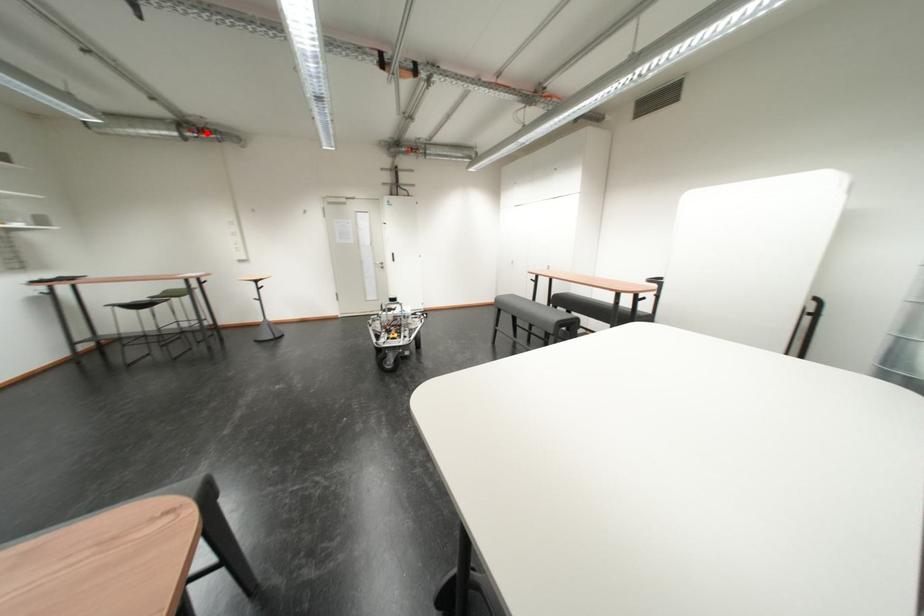
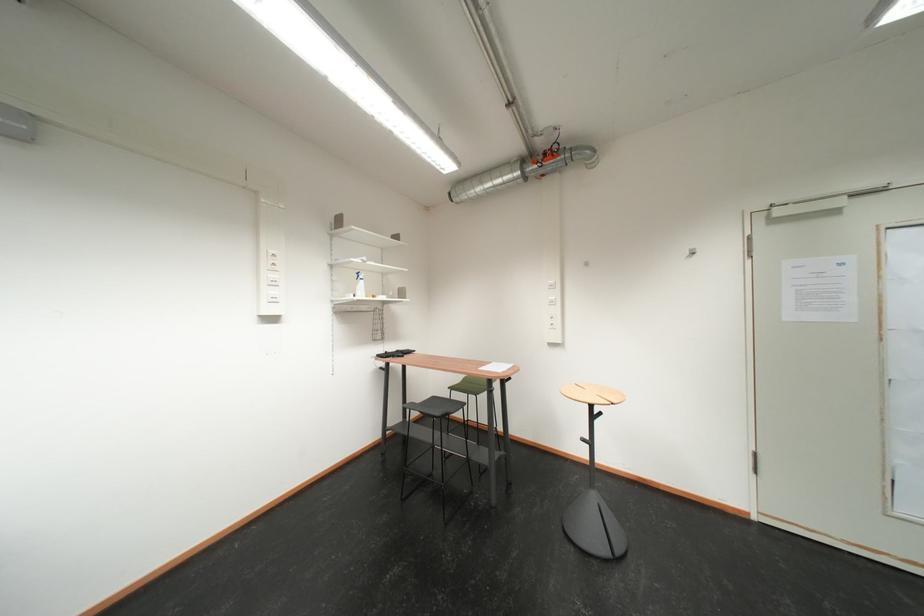
The point at the highlighted location is marked in the first image. Where is the corresponding point in the second image?

(552, 160)